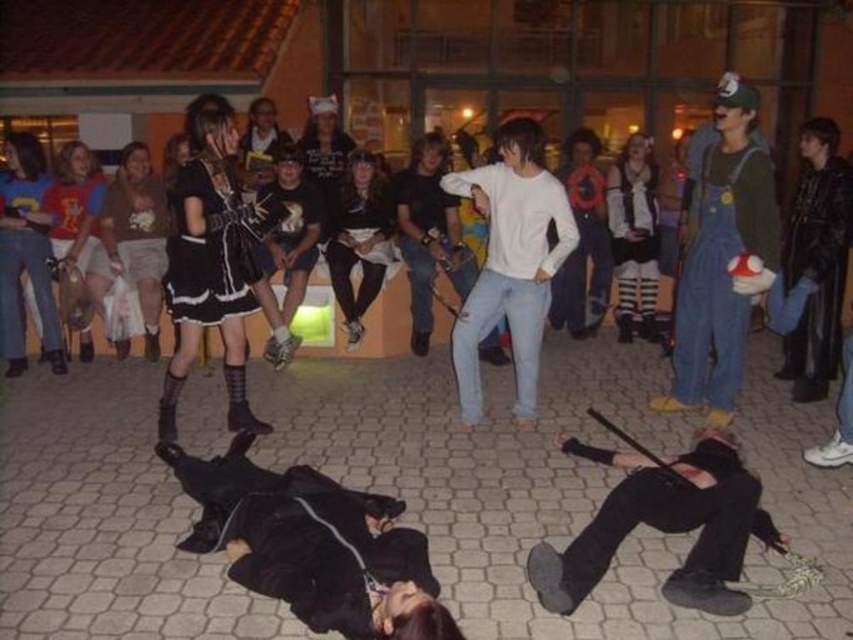
Based on the photo, you are standing in the scene described and want to locate the black leather pants at lower center. What are the coordinates where you should look?

The black leather pants at lower center are located at point coordinates of (664, 525).

You are a photographer at the event and want to capture a photo that includes both the black leather pants at lower center and the denim overalls at center right. Which object should be placed closer to the bottom of the frame to ensure both are visible?

The black leather pants at lower center should be placed closer to the bottom of the frame because it is located below the denim overalls at center right in the scene.

You are a photographer setting up for a night shoot at this event. You need to position a light stand between the black leather pants at lower center and the denim overalls at center right. Based on their heights, will the light stand that is 1.2 meters tall be visible above both objects?

The black leather pants at lower center is shorter than the denim overalls at center right. Since the light stand is 1.2 meters tall, it will be visible above both objects only if it is placed between them and elevated properly.